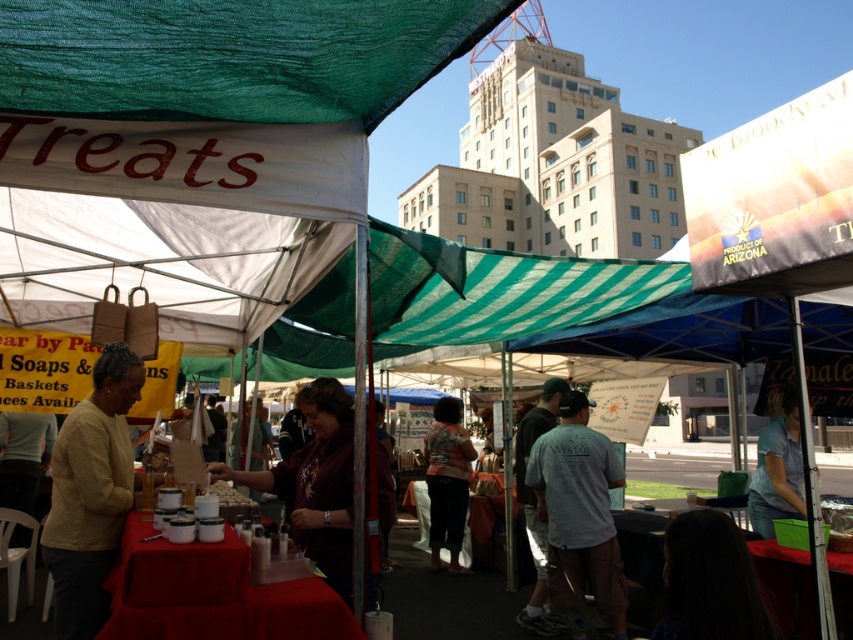
Is yellow knitted sweater at left shorter than floral-patterned shirt at center?

Yes, yellow knitted sweater at left is shorter than floral-patterned shirt at center.

How distant is yellow knitted sweater at left from floral-patterned shirt at center?

They are 15.91 feet apart.

Between point (91, 472) and point (431, 536), which one is positioned behind?

The point (431, 536) is more distant.

Where is `yellow knitted sweater at left`? The width and height of the screenshot is (853, 640). yellow knitted sweater at left is located at coordinates (91, 493).

Is yellow knitted sweater at left to the right of light gray cotton shirt at center from the viewer's perspective?

Incorrect, yellow knitted sweater at left is not on the right side of light gray cotton shirt at center.

Is yellow knitted sweater at left wider than light gray cotton shirt at center?

No, yellow knitted sweater at left is not wider than light gray cotton shirt at center.

Between point (144, 378) and point (543, 481), which one is positioned behind?

Positioned behind is point (543, 481).

This screenshot has width=853, height=640. What are the coordinates of `yellow knitted sweater at left` in the screenshot? It's located at (91, 493).

Does light gray cotton shirt at center have a lesser height compared to floral-patterned shirt at center?

Yes.

Measure the distance between light gray cotton shirt at center and camera.

light gray cotton shirt at center is 15.81 feet away from camera.

Identify the location of light gray cotton shirt at center. This screenshot has width=853, height=640. (579, 513).